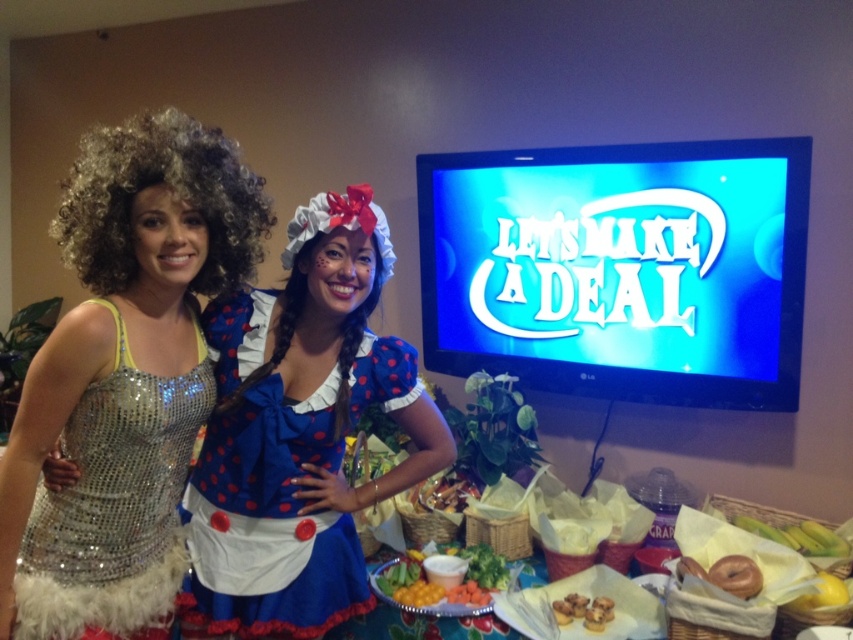
Is point (97, 577) in front of point (498, 586)?

Yes, point (97, 577) is in front of point (498, 586).

Who is more distant from viewer, (199, 273) or (451, 595)?

The point (451, 595) is behind.

Find the location of a particular element. This screenshot has width=853, height=640. shiny sequined dress at left is located at coordinates (123, 376).

Looking at this image, does vibrant orange carrot at center appear on the left side of yellow banana at lower right?

Yes, vibrant orange carrot at center is to the left of yellow banana at lower right.

Is vibrant orange carrot at center smaller than yellow banana at lower right?

Actually, vibrant orange carrot at center might be larger than yellow banana at lower right.

Describe the element at coordinates (437, 580) in the screenshot. The height and width of the screenshot is (640, 853). I see `vibrant orange carrot at center` at that location.

Where is `vibrant orange carrot at center`? This screenshot has height=640, width=853. vibrant orange carrot at center is located at coordinates (437, 580).

Measure the distance between sparkly silver dress at left and yellow banana at lower right.

They are 5.60 feet apart.

Is sparkly silver dress at left further to the viewer compared to yellow banana at lower right?

No, sparkly silver dress at left is in front of yellow banana at lower right.

Does point (196, 424) lie behind point (831, 531)?

No, it is not.

Locate an element on the screen. sparkly silver dress at left is located at coordinates (114, 502).